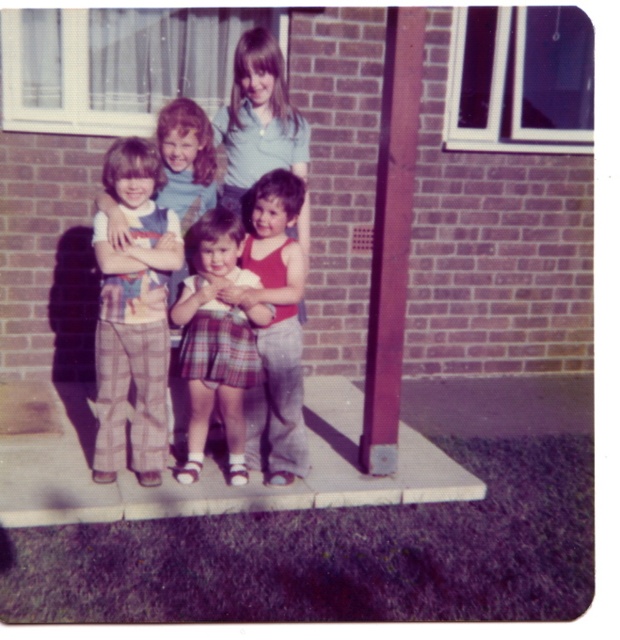
Question: Based on their relative distances, which object is nearer to the matte red tank top at center?

Choices:
 (A) white concrete porch at center
 (B) plaid skirt at center
 (C) matte blue shirt at center

Answer: (B)

Question: Is plaid pants at left smaller than smooth purple pole at center?

Choices:
 (A) no
 (B) yes

Answer: (B)

Question: Which object is positioned farthest from the white concrete porch at center?

Choices:
 (A) smooth purple pole at center
 (B) plaid pants at left

Answer: (A)

Question: Is white concrete porch at center bigger than plaid skirt at center?

Choices:
 (A) no
 (B) yes

Answer: (B)

Question: In this image, where is plaid pants at left located relative to matte red tank top at center?

Choices:
 (A) left
 (B) right

Answer: (A)

Question: Which of these objects is positioned farthest from the smooth purple pole at center?

Choices:
 (A) plaid skirt at center
 (B) plaid pants at left
 (C) matte blue shirt at center
 (D) white concrete porch at center

Answer: (B)